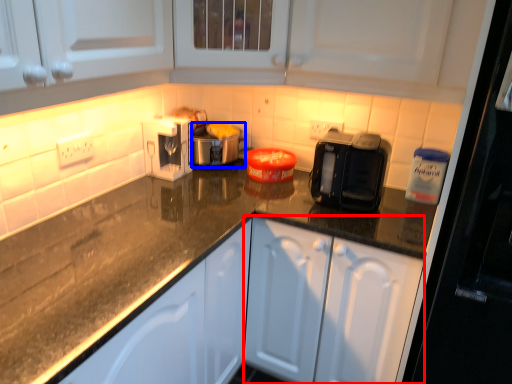
Question: Which point is further to the camera, cabinetry (highlighted by a red box) or appliance (highlighted by a blue box)?

Choices:
 (A) cabinetry
 (B) appliance

Answer: (B)